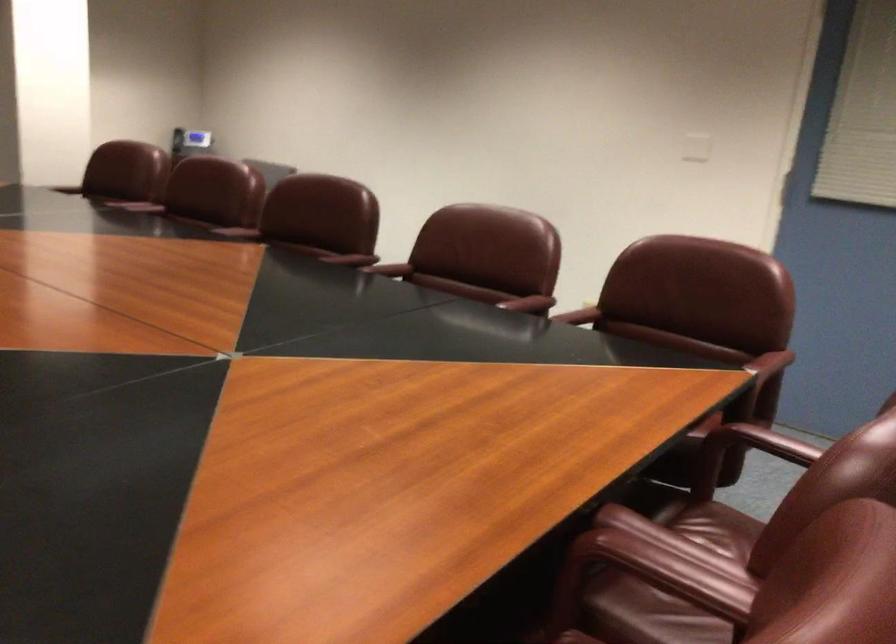
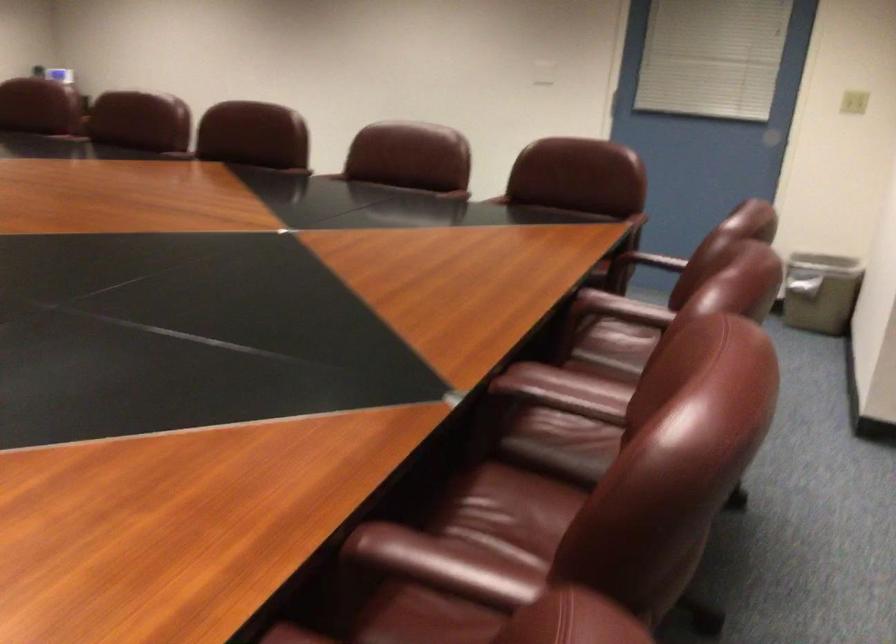
Question: How did the camera likely rotate?

Choices:
 (A) Left
 (B) Right
 (C) Up
 (D) Down

Answer: (B)